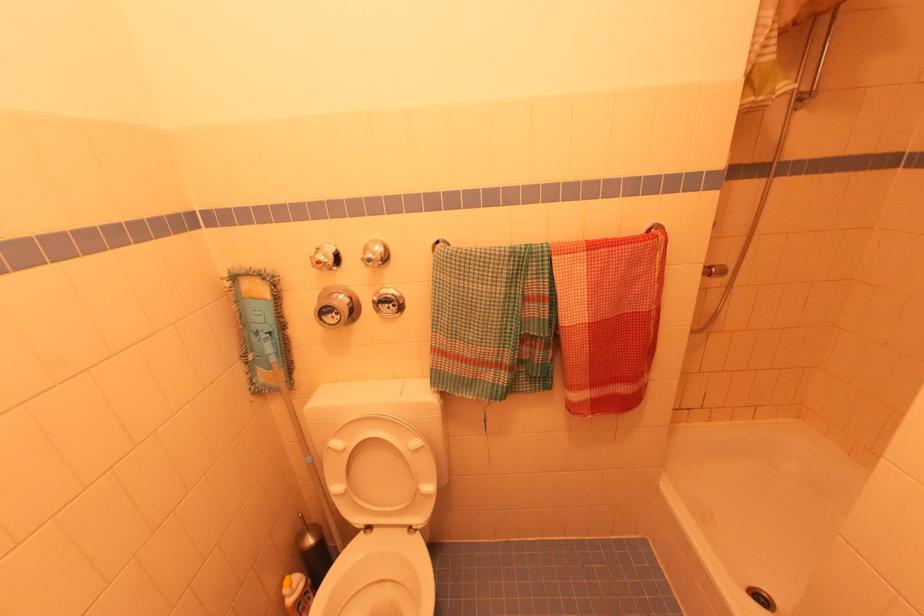
This screenshot has height=616, width=924. In order to click on red-marked wall knob in this screenshot , I will do `click(322, 256)`.